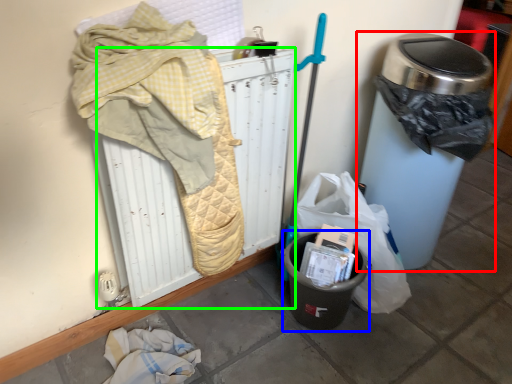
Question: Which is nearer to the waste container (highlighted by a red box)? recycling bin (highlighted by a blue box) or radiator (highlighted by a green box).

Choices:
 (A) recycling bin
 (B) radiator

Answer: (A)